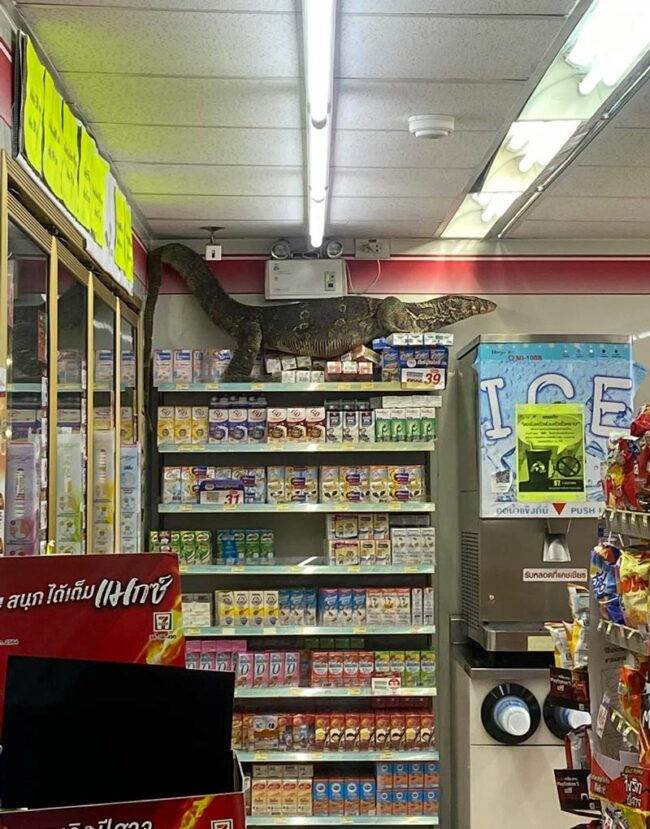
Locate an element on the screen. The image size is (650, 829). wall is located at coordinates (548, 313).